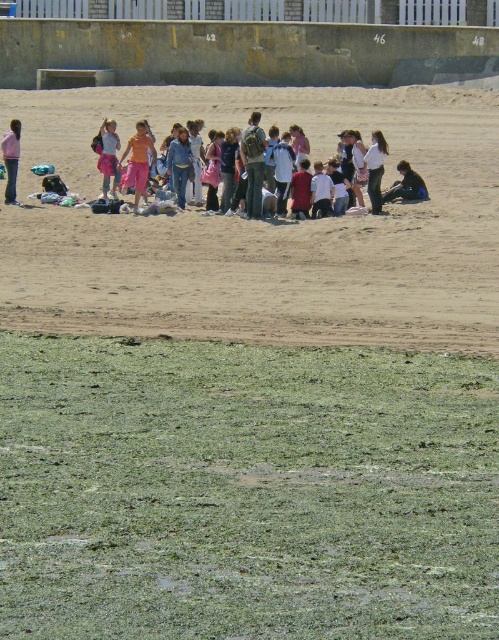
You are standing at the origin point of the coordinate system in the image. You want to walk to the brown sandy beach at center. Which direction should you move to reach it?

The brown sandy beach at center is located at coordinate point 0.358 on the x axis and 0.529 on the y axis. Since you are at the origin point, you should move towards the positive x and positive y direction to reach it.

You are a photographer trying to capture a group photo of the pink fabric pants at center and the white matte shirt at center. The camera you are using has a maximum focus range of 7 meters. Can you take a photo of both subjects without moving either of them?

The distance between the pink fabric pants at center and the white matte shirt at center is 7.49 meters. Since the camera can only focus up to 7 meters, it will not be able to capture both subjects clearly without moving them closer.